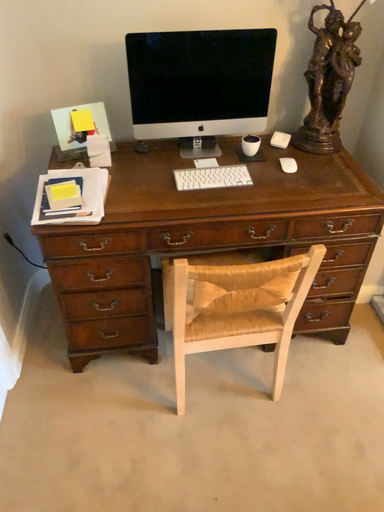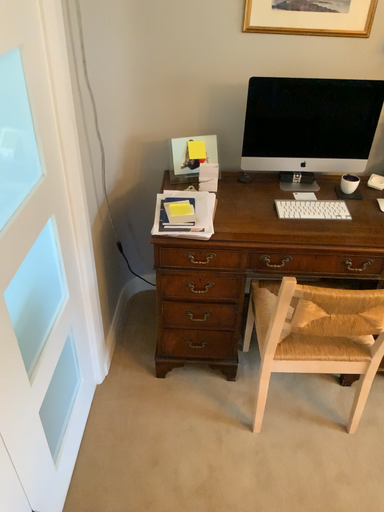
Question: How did the camera likely rotate when shooting the video?

Choices:
 (A) rotated left
 (B) rotated right

Answer: (A)